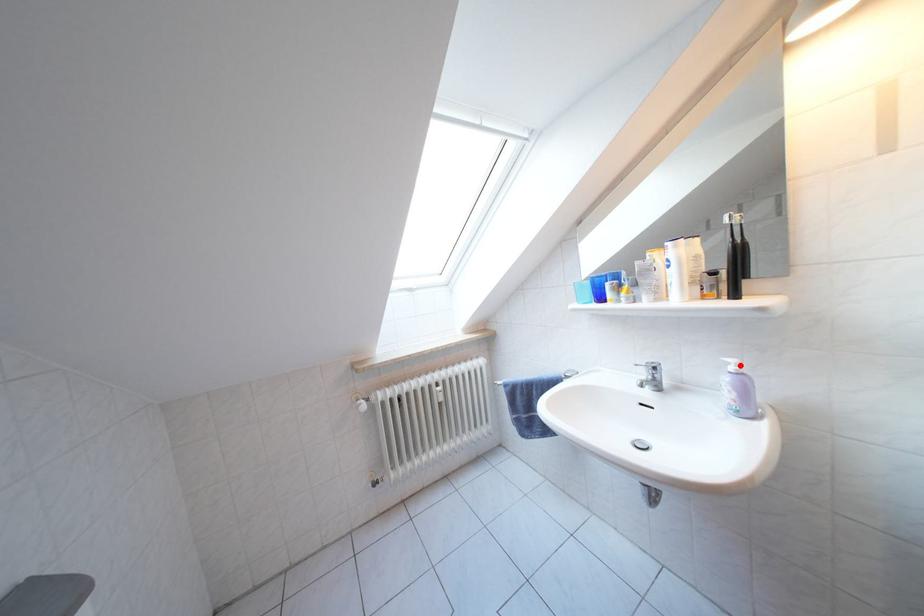
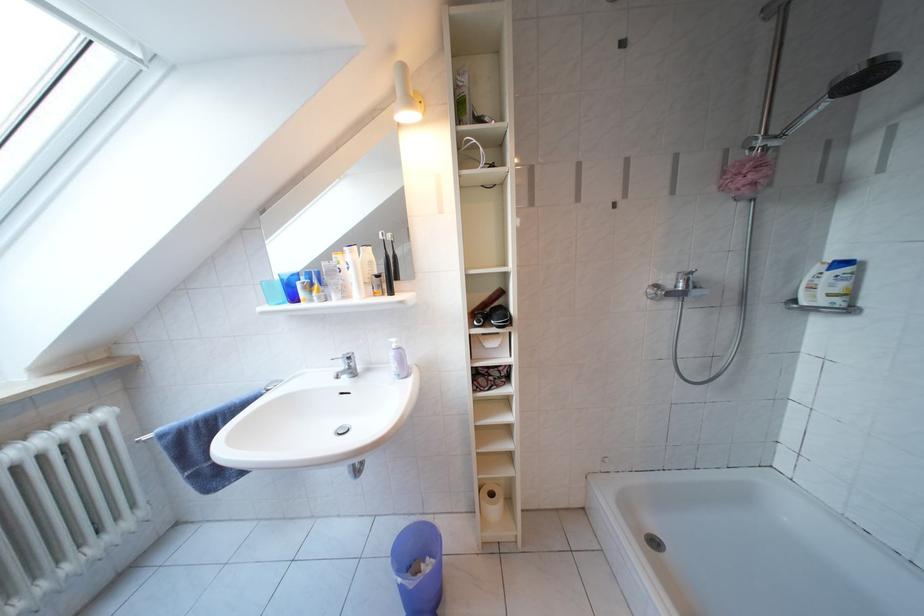
The point at the highlighted location is marked in the first image. Where is the corresponding point in the second image?

(402, 345)